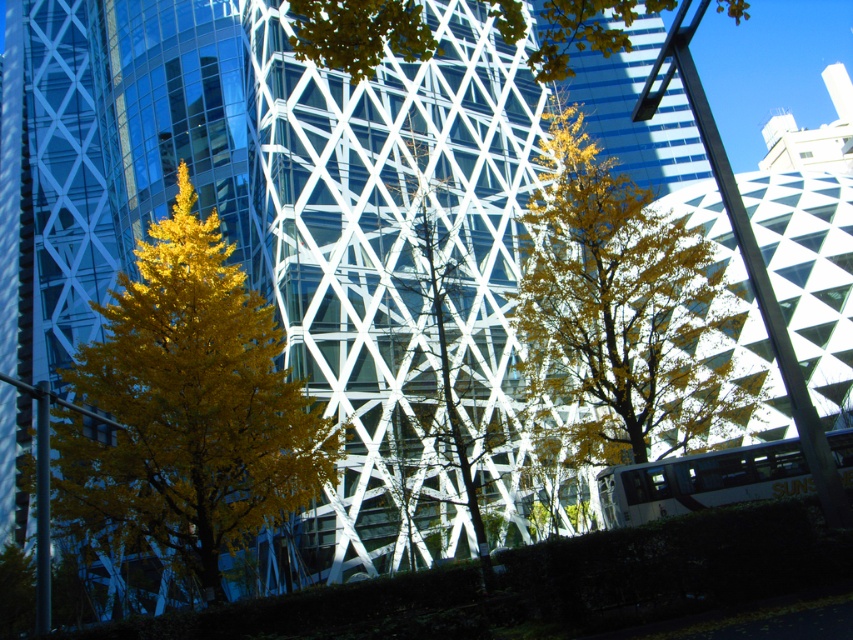
You are a bird looking for a nesting spot. You see the yellow leafy tree at upper center and the green leafy tree at center. Which tree is taller and would provide a better nesting spot?

The yellow leafy tree at upper center is much taller than the green leafy tree at center, so it would provide a better nesting spot.

Based on the photo, you are standing in front of the modern building and notice two trees in the center of the image. Which tree is bigger between the yellow leafy tree at center and the green leafy tree at center?

The yellow leafy tree at center is larger in size than the green leafy tree at center.

You are a city planner assessing the urban space. You notice two trees at the center of the scene, a yellow leafy tree at center and a green leafy tree at center. Which tree would require less vertical space in the city layout?

The yellow leafy tree at center has a lesser height compared to the green leafy tree at center, so it requires less vertical space in the city layout.